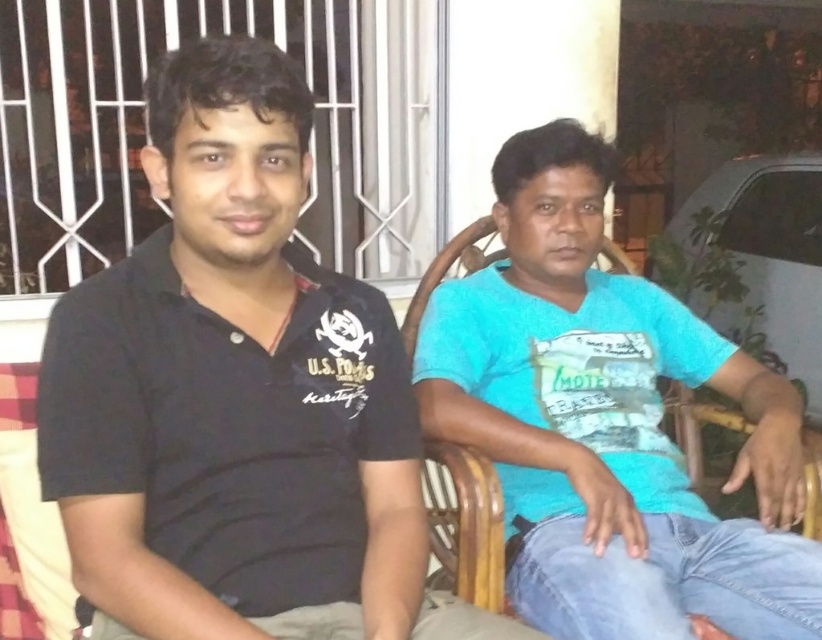
Question: Does black cotton shirt at left come in front of blue cotton shirt at center?

Choices:
 (A) yes
 (B) no

Answer: (A)

Question: Which of the following is the farthest from the observer?

Choices:
 (A) black cotton shirt at left
 (B) blue cotton shirt at center

Answer: (B)

Question: Is black cotton shirt at left to the left of blue cotton shirt at center from the viewer's perspective?

Choices:
 (A) no
 (B) yes

Answer: (B)

Question: Which point appears farthest from the camera in this image?

Choices:
 (A) (515, 176)
 (B) (159, 269)

Answer: (A)

Question: Is black cotton shirt at left wider than blue cotton shirt at center?

Choices:
 (A) yes
 (B) no

Answer: (B)

Question: Which point is closer to the camera?

Choices:
 (A) blue cotton shirt at center
 (B) black cotton shirt at left

Answer: (B)